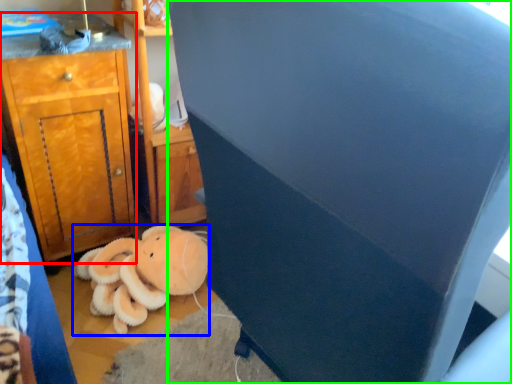
Question: Which object is positioned closest to cabinetry (highlighted by a red box)? Select from teddy bear (highlighted by a blue box) and furniture (highlighted by a green box).

Choices:
 (A) teddy bear
 (B) furniture

Answer: (A)